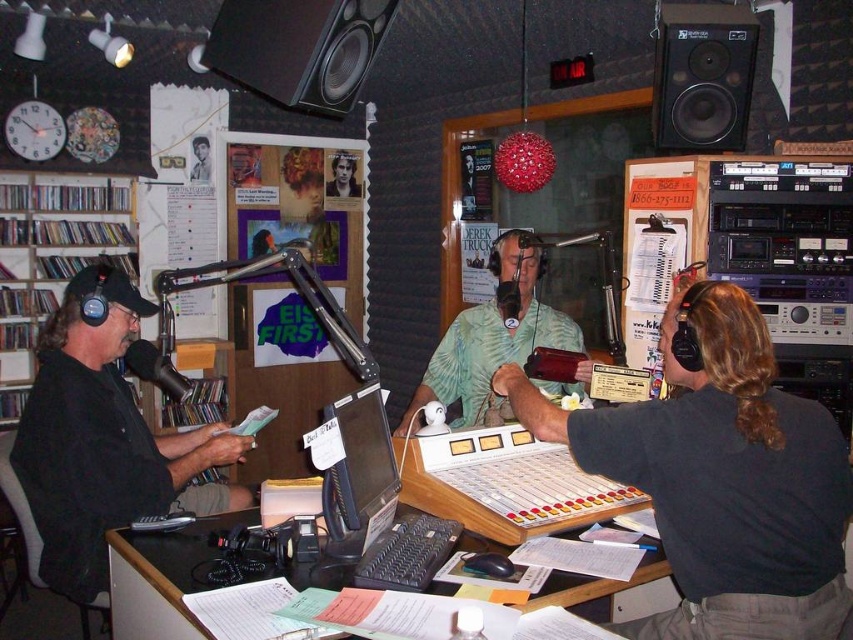
Is wooden desk at center in front of black matte speaker at upper right?

Yes, it is.

Based on the photo, is wooden desk at center positioned at the back of black matte speaker at upper right?

No.

Which is behind, point (567, 532) or point (734, 99)?

The point (734, 99) is more distant.

Find the location of a particular element. wooden desk at center is located at coordinates 161,579.

Between point (12, 324) and point (442, 353), which one is positioned in front?

Point (442, 353) is more forward.

Based on the photo, between wooden bookshelf at left and green textured shirt at center, which one has less height?

With less height is green textured shirt at center.

This screenshot has height=640, width=853. What do you see at coordinates (50, 259) in the screenshot? I see `wooden bookshelf at left` at bounding box center [50, 259].

Find the location of a particular element. wooden bookshelf at left is located at coordinates (50, 259).

Does dark gray shirt at center have a greater height compared to wooden desk at center?

Yes.

Which is behind, point (612, 438) or point (132, 628)?

The point (132, 628) is more distant.

This screenshot has width=853, height=640. What are the coordinates of `dark gray shirt at center` in the screenshot? It's located at (721, 477).